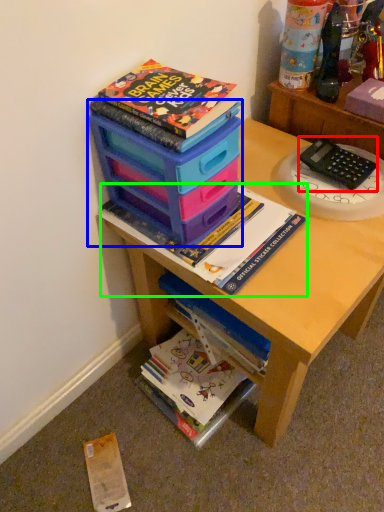
Question: Which object is positioned farthest from equipment (highlighted by a red box)? Select from storage box (highlighted by a blue box) and book (highlighted by a green box).

Choices:
 (A) storage box
 (B) book

Answer: (A)